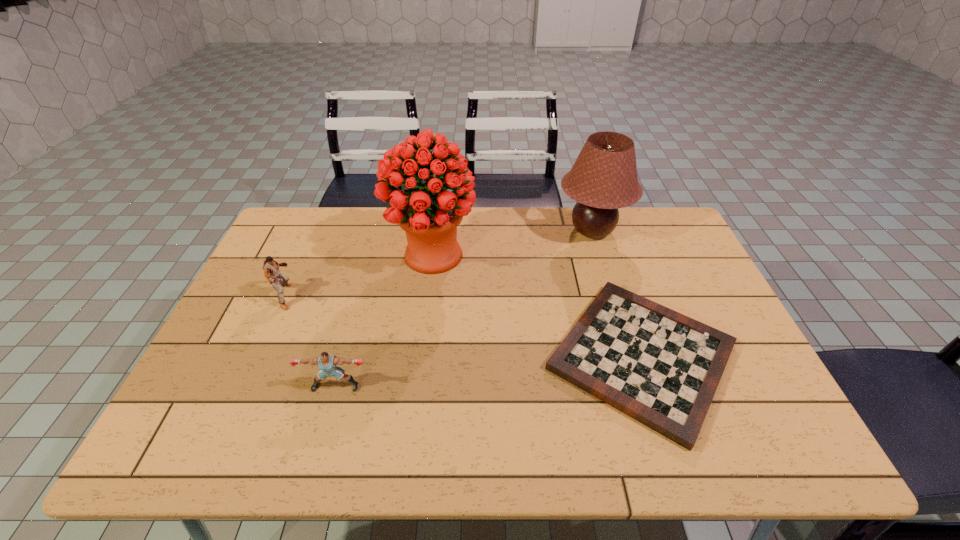
I want to click on vacant space located 0.060m on the front-facing side of the second tallest object, so click(x=538, y=231).

Locate an element on the screen. free space located on the front-facing side of the farther puncher is located at coordinates (362, 296).

Where is `vacant space located on the front-facing side of the fourth tallest object`? This screenshot has width=960, height=540. vacant space located on the front-facing side of the fourth tallest object is located at coordinates (318, 450).

Where is `blank space located on the left of the chessboard`? blank space located on the left of the chessboard is located at coordinates (386, 356).

Identify the location of bouquet positioned at the far edge. The image size is (960, 540). (429, 214).

Where is `lampshade located at the far edge`? This screenshot has width=960, height=540. lampshade located at the far edge is located at coordinates (604, 178).

Where is `object present at the near edge`? object present at the near edge is located at coordinates (662, 368).

Where is `object at the left edge`? The height and width of the screenshot is (540, 960). object at the left edge is located at coordinates (271, 269).

At what (x,y) coordinates should I click in order to perform the action: click on object present at the right edge. Please return your answer as a coordinate pair (x, y). Looking at the image, I should click on [x=662, y=368].

Where is `object that is at the near right corner`? This screenshot has height=540, width=960. object that is at the near right corner is located at coordinates [x=662, y=368].